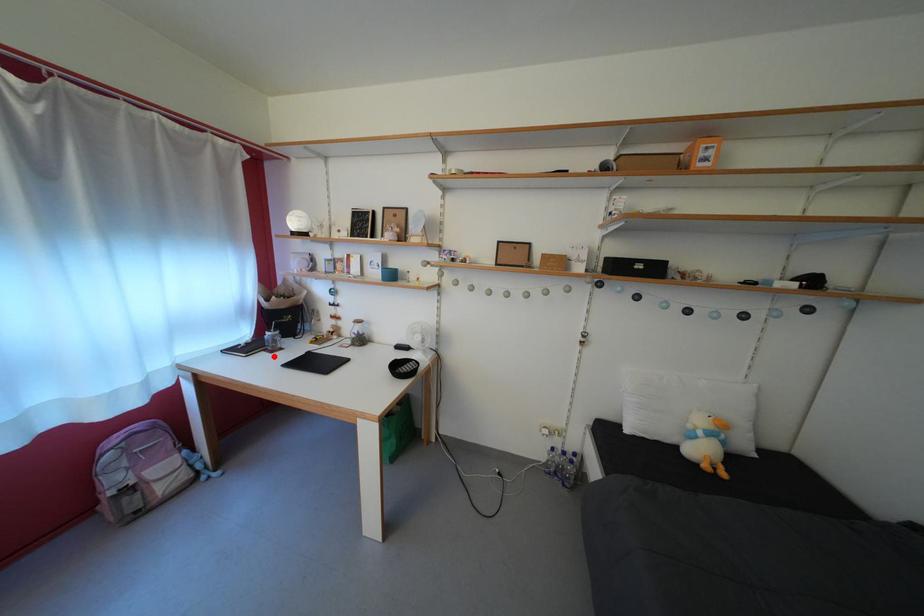
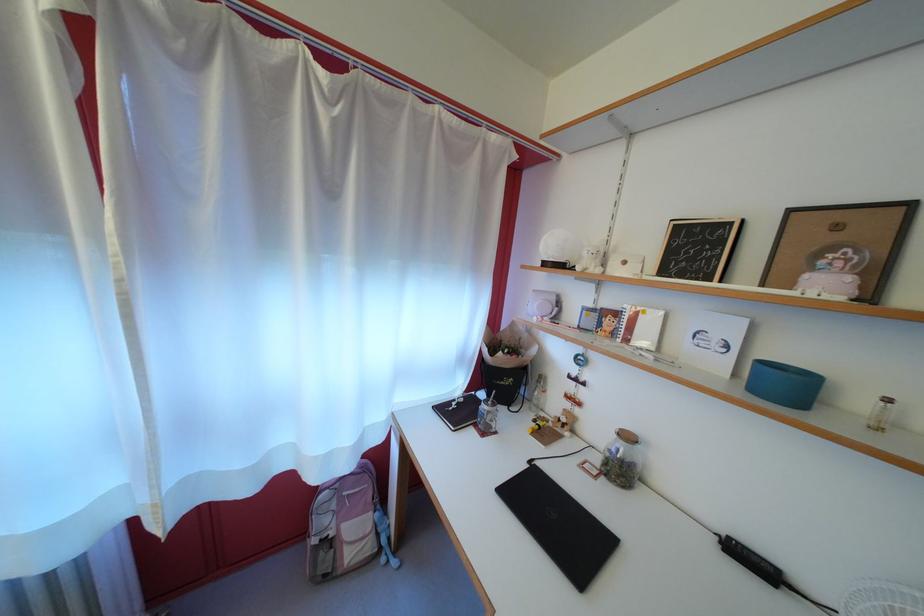
In the second image, find the point that corresponds to the highlighted location in the first image.

(483, 431)